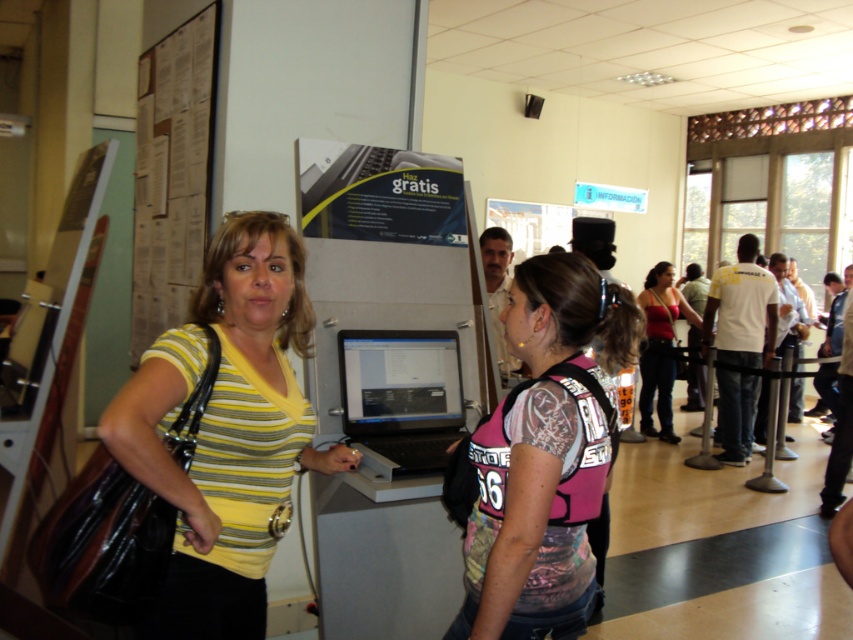
You are a customer in a service center and need to adjust your clothing to fit through a narrow doorway. You have the pink fabric vest at center and the cardboard posters at upper left nearby. Which item can you wear without worrying about it getting caught in the doorway?

The pink fabric vest at center has a smaller width than the cardboard posters at upper left, so it is less likely to get caught in the doorway. You can wear the pink fabric vest at center safely.

You are a customer service representative in the office and need to determine the relative size of two items in the scene. Which object is smaller between the pink fabric vest at center and the cardboard posters at upper left?

The pink fabric vest at center is smaller than the cardboard posters at upper left according to the description.

You are a customer service representative in the office and need to access a laptop to assist a client. You see the matte black laptop at center and the matte red tank top at center. Which object is located lower in the scene?

The matte black laptop at center is positioned under the matte red tank top at center, so it is located lower in the scene.